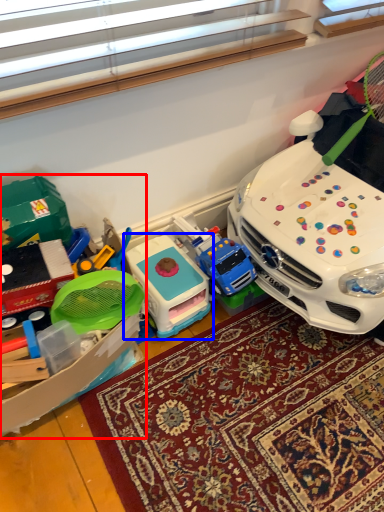
Question: Which object appears closest to the camera in this image, toy (highlighted by a red box) or toy (highlighted by a blue box)?

Choices:
 (A) toy
 (B) toy

Answer: (A)